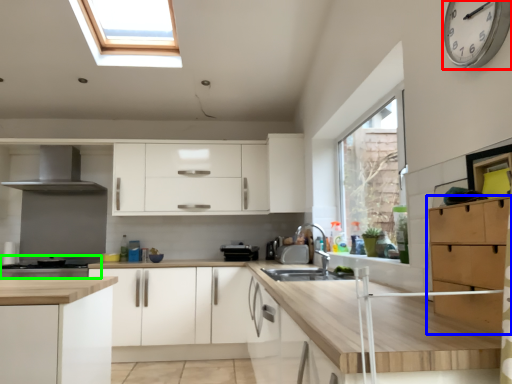
Question: Estimate the real-world distances between objects in this image. Which object is closer to clock (highlighted by a red box), cabinetry (highlighted by a blue box) or home appliance (highlighted by a green box)?

Choices:
 (A) cabinetry
 (B) home appliance

Answer: (A)